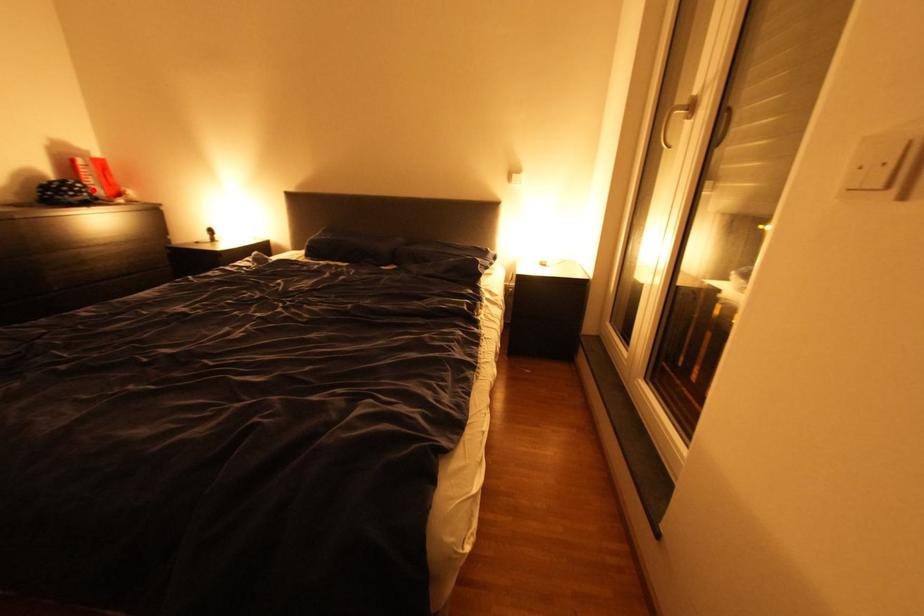
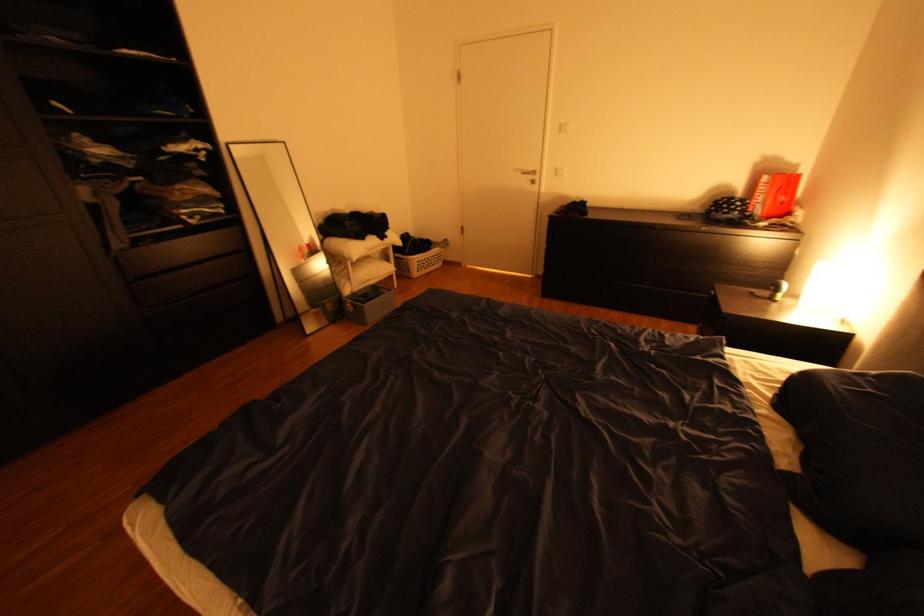
Where in the second image is the point corresponding to the highlighted location from the first image?

(748, 208)